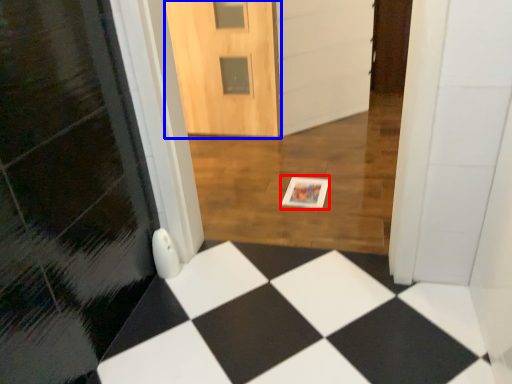
Question: Which point is further to the camera, postcard (highlighted by a red box) or door (highlighted by a blue box)?

Choices:
 (A) postcard
 (B) door

Answer: (B)